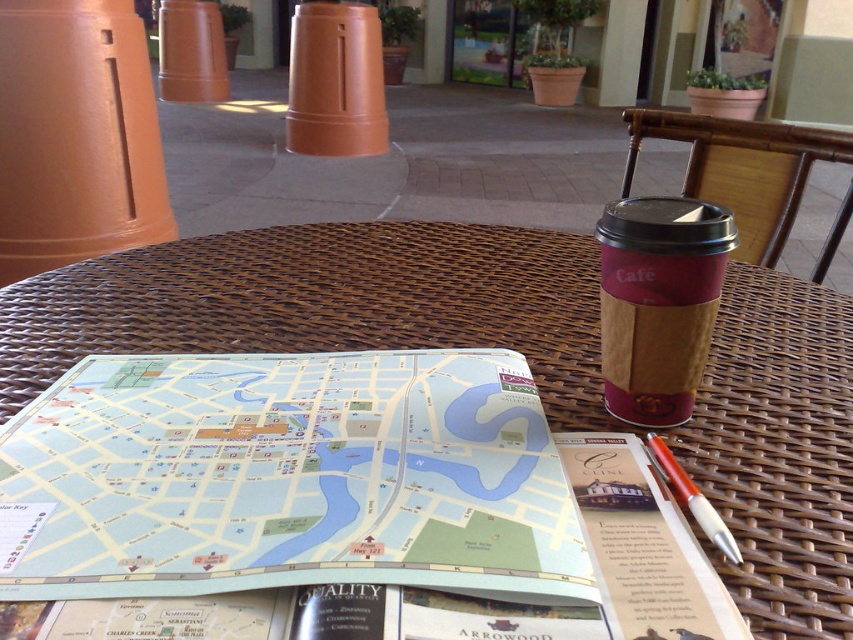
Can you confirm if brown wicker table at center is wider than brown paper cup at upper right?

Indeed, brown wicker table at center has a greater width compared to brown paper cup at upper right.

Which is in front, point (407, 324) or point (602, 275)?

Point (602, 275) is more forward.

What are the coordinates of `brown wicker table at center` in the screenshot? It's located at (323, 301).

The image size is (853, 640). What are the coordinates of `brown wicker table at center` in the screenshot? It's located at (323, 301).

Does light blue paper map at center lie in front of orange pen at right?

That is True.

Between light blue paper map at center and orange pen at right, which one appears on the right side from the viewer's perspective?

orange pen at right is more to the right.

Which is behind, point (550, 586) or point (647, 440)?

Point (647, 440)

Locate an element on the screen. light blue paper map at center is located at coordinates (288, 477).

Does light blue paper map at center appear on the right side of brown wicker table at center?

In fact, light blue paper map at center is to the left of brown wicker table at center.

Is light blue paper map at center in front of brown wicker table at center?

Yes, light blue paper map at center is in front of brown wicker table at center.

Is point (494, 484) closer to camera compared to point (351, 300)?

Yes.

The image size is (853, 640). Identify the location of light blue paper map at center. (288, 477).